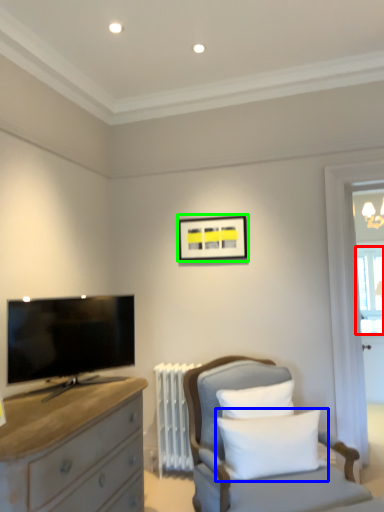
Question: Based on their relative distances, which object is farther from window screen (highlighted by a red box)? Choose from pillow (highlighted by a blue box) and picture frame (highlighted by a green box).

Choices:
 (A) pillow
 (B) picture frame

Answer: (A)